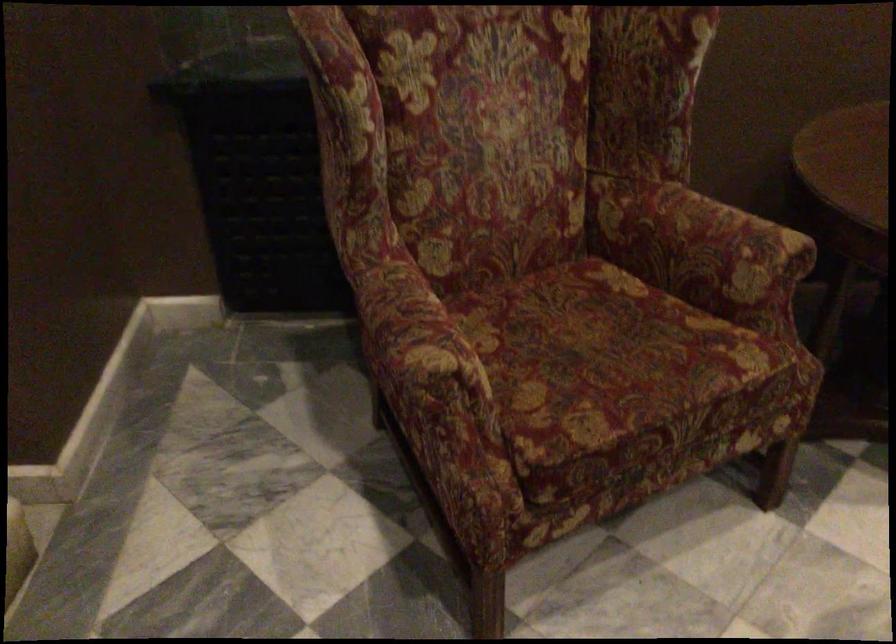
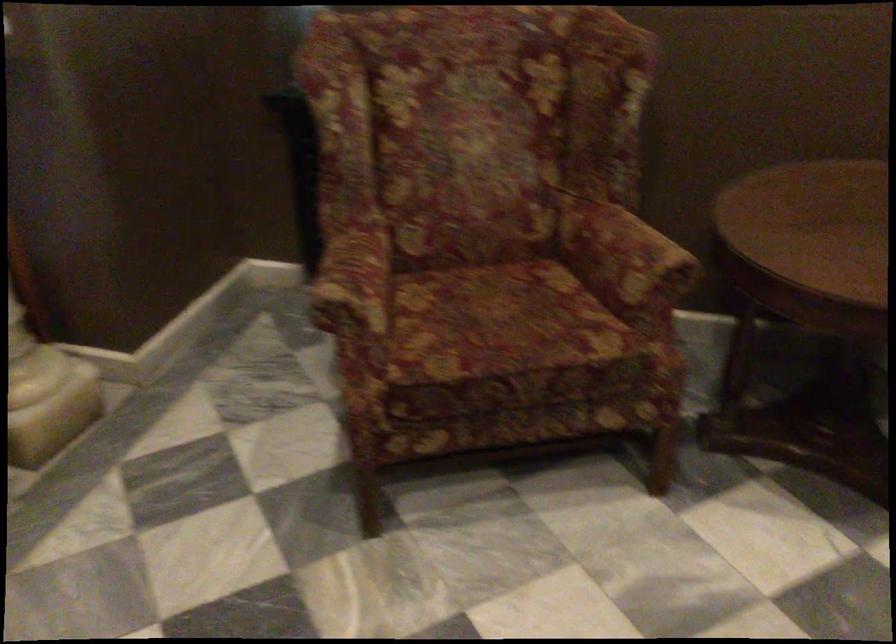
Question: The camera is either moving clockwise (left) or counter-clockwise (right) around the object. The first image is from the beginning of the video and the second image is from the end. Is the camera moving left or right when shooting the video?

Choices:
 (A) Left
 (B) Right

Answer: (B)